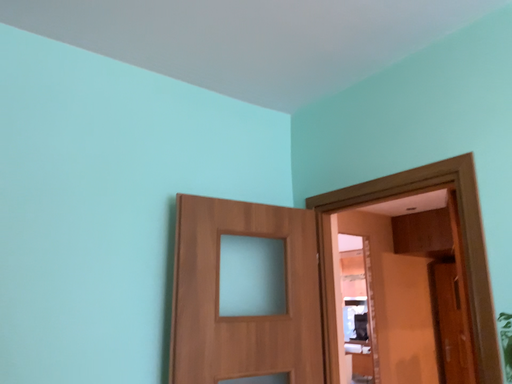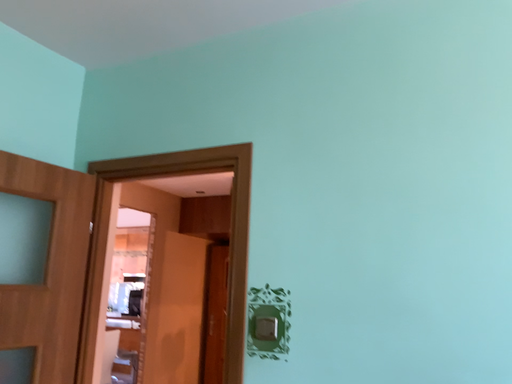
Question: How did the camera likely rotate when shooting the video?

Choices:
 (A) rotated left
 (B) rotated right

Answer: (B)